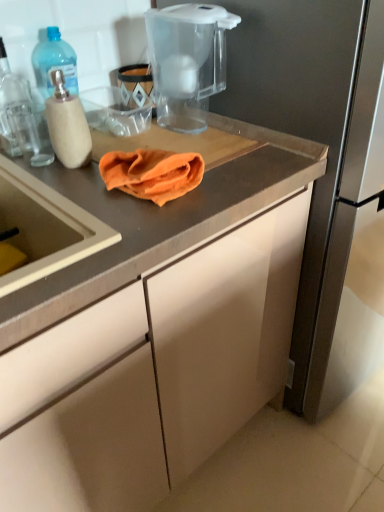
Find the location of a particular element. free spot to the right of orange cloth at center is located at coordinates (237, 175).